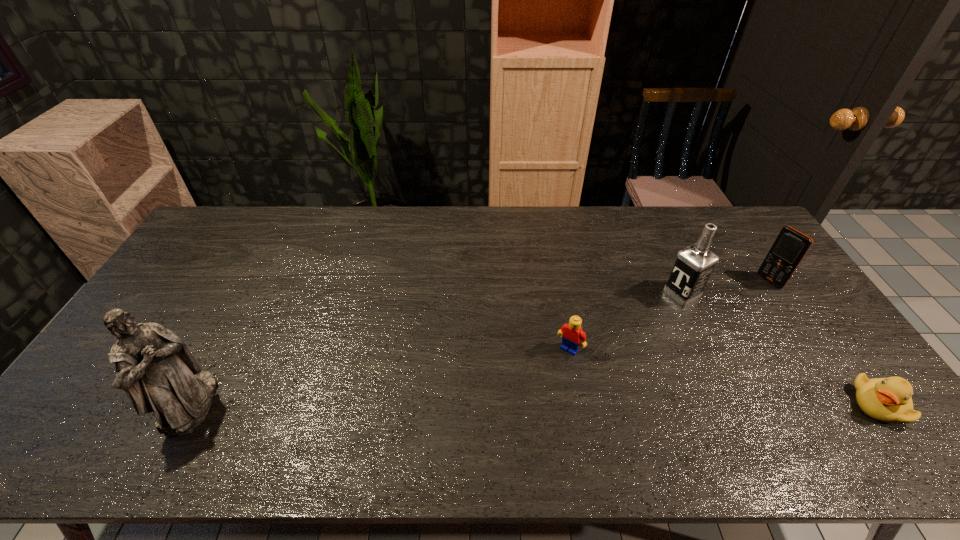
Locate an element on the screen. This screenshot has height=540, width=960. free region located 0.220m on the front-facing side of the duckling is located at coordinates (767, 404).

Locate an element on the screen. This screenshot has width=960, height=540. vacant space located on the front-facing side of the duckling is located at coordinates (739, 404).

The height and width of the screenshot is (540, 960). Identify the location of vacant area situated on the face of the second object from left to right. (538, 393).

This screenshot has height=540, width=960. I want to click on free spot located on the front label of the fourth shortest object, so click(x=571, y=354).

Locate an element on the screen. The image size is (960, 540). free space located on the front label of the fourth shortest object is located at coordinates (614, 330).

Where is `free location located 0.280m on the front label of the fourth shortest object`? This screenshot has width=960, height=540. free location located 0.280m on the front label of the fourth shortest object is located at coordinates pos(601,338).

Locate an element on the screen. vacant space situated on the screen of the third shortest object is located at coordinates (702, 323).

This screenshot has width=960, height=540. Identify the location of vacant space situated 0.250m on the screen of the third shortest object. (713, 316).

The width and height of the screenshot is (960, 540). I want to click on free spot located 0.180m on the screen of the third shortest object, so click(729, 307).

Identify the location of figurine that is positioned at the near edge. Image resolution: width=960 pixels, height=540 pixels. (154, 367).